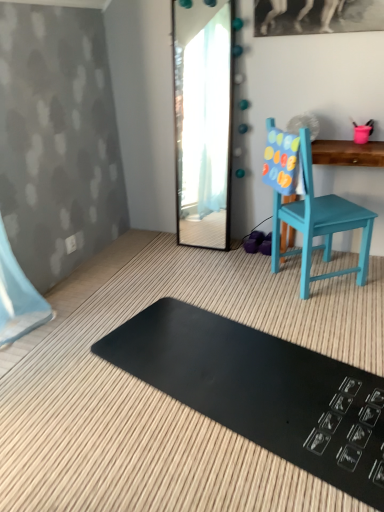
Question: Is black rubber mat at lower center further to camera compared to clear glass mirror at center?

Choices:
 (A) yes
 (B) no

Answer: (B)

Question: Considering the relative sizes of black rubber mat at lower center and clear glass mirror at center in the image provided, is black rubber mat at lower center bigger than clear glass mirror at center?

Choices:
 (A) yes
 (B) no

Answer: (B)

Question: Would you say clear glass mirror at center is part of black rubber mat at lower center's contents?

Choices:
 (A) no
 (B) yes

Answer: (A)

Question: Considering the relative sizes of black rubber mat at lower center and clear glass mirror at center in the image provided, is black rubber mat at lower center wider than clear glass mirror at center?

Choices:
 (A) yes
 (B) no

Answer: (A)

Question: From a real-world perspective, is black rubber mat at lower center physically below clear glass mirror at center?

Choices:
 (A) no
 (B) yes

Answer: (B)

Question: Does black rubber mat at lower center lie in front of clear glass mirror at center?

Choices:
 (A) no
 (B) yes

Answer: (B)

Question: Does clear glass mirror at center turn towards teal painted wood chair at right?

Choices:
 (A) yes
 (B) no

Answer: (B)

Question: Does clear glass mirror at center lie behind teal painted wood chair at right?

Choices:
 (A) yes
 (B) no

Answer: (A)

Question: Is clear glass mirror at center at the left side of teal painted wood chair at right?

Choices:
 (A) yes
 (B) no

Answer: (A)

Question: Is clear glass mirror at center thinner than teal painted wood chair at right?

Choices:
 (A) no
 (B) yes

Answer: (B)

Question: Does clear glass mirror at center have a greater width compared to teal painted wood chair at right?

Choices:
 (A) yes
 (B) no

Answer: (B)

Question: Can you confirm if clear glass mirror at center is taller than teal painted wood chair at right?

Choices:
 (A) yes
 (B) no

Answer: (A)

Question: Is teal painted wood chair at right bigger than clear glass mirror at center?

Choices:
 (A) no
 (B) yes

Answer: (B)